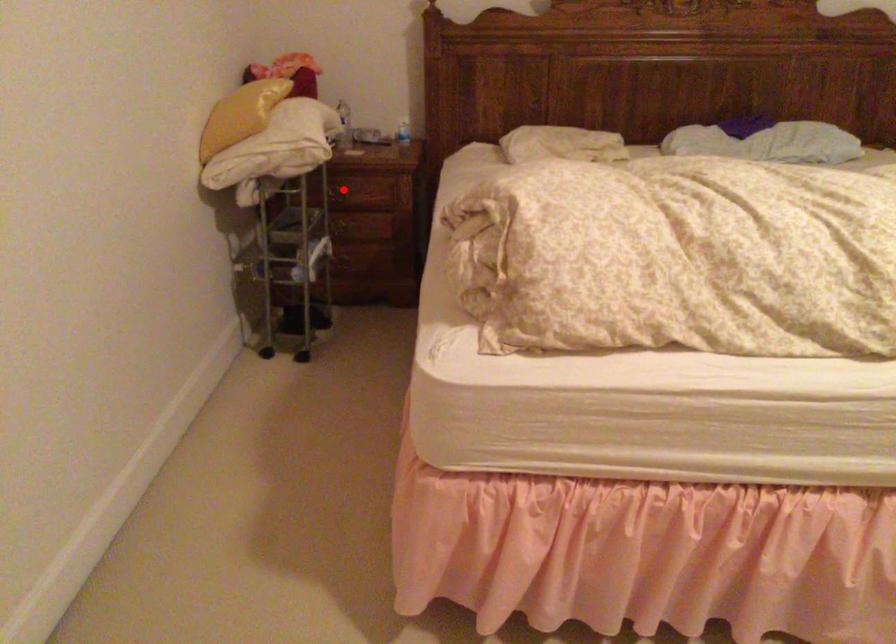
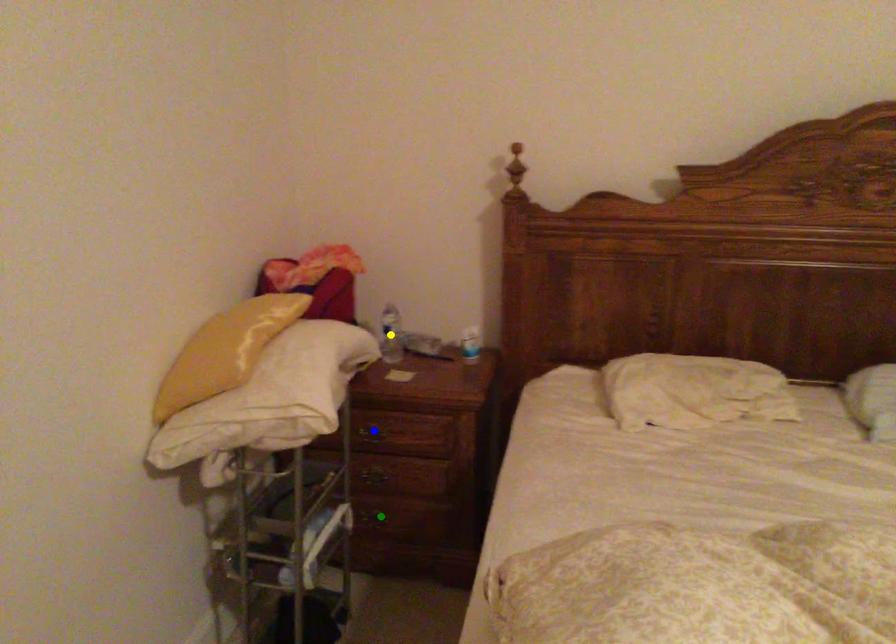
Question: I am providing you with two images of the same scene from different viewpoints. A red point is marked on the first image. You are given multiple points on the second image. Which mark in image 2 goes with the point in image 1?

Choices:
 (A) blue point
 (B) yellow point
 (C) green point

Answer: (A)